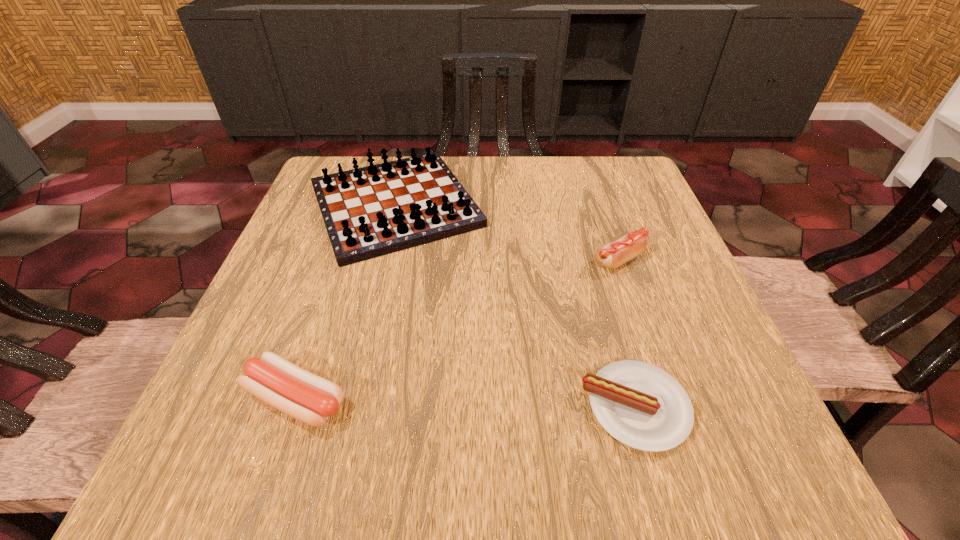
This screenshot has height=540, width=960. I want to click on the tallest object, so click(371, 211).

Where is `the farthest sausage`? the farthest sausage is located at coordinates (612, 255).

The width and height of the screenshot is (960, 540). Identify the location of the leftmost sausage. (309, 398).

Find the location of a particular element. The height and width of the screenshot is (540, 960). the shortest object is located at coordinates (642, 406).

Identify the location of vacant space positioned on the front of the tallest object. The image size is (960, 540). (344, 421).

Find the location of a particular element. free space located on the left of the farthest sausage is located at coordinates (439, 260).

I want to click on vacant space located 0.340m on the back of the leftmost sausage, so click(351, 234).

Where is `vacant point located 0.100m on the right of the shortest object`? This screenshot has width=960, height=540. vacant point located 0.100m on the right of the shortest object is located at coordinates coord(756,407).

Where is `object that is positioned at the far edge`? The height and width of the screenshot is (540, 960). object that is positioned at the far edge is located at coordinates (371, 211).

The image size is (960, 540). In order to click on chessboard positioned at the left edge in this screenshot , I will do `click(371, 211)`.